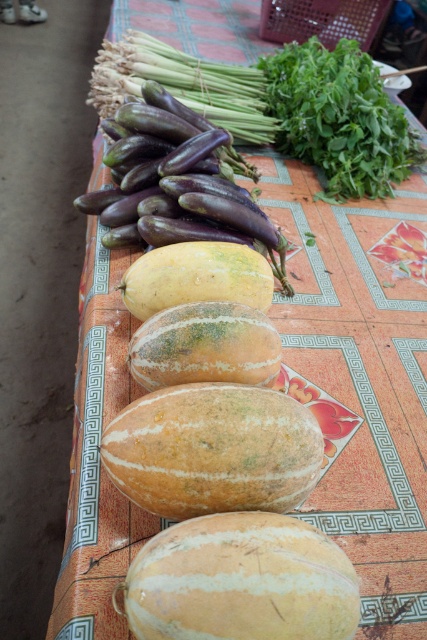
Question: Is green striped melon at center thinner than yellow-green matte squash at center?

Choices:
 (A) no
 (B) yes

Answer: (B)

Question: Based on their relative distances, which object is nearer to the greenish-yellow textured cantaloupe at center?

Choices:
 (A) yellow-green matte squash at center
 (B) green striped melon at center

Answer: (B)

Question: Which point is closer to the camera?

Choices:
 (A) (183, 372)
 (B) (125, 275)
 (C) (183, 464)
 (D) (222, 547)

Answer: (D)

Question: Which point is farther to the camera?

Choices:
 (A) greenish-yellow textured cantaloupe at center
 (B) purple matte eggplant at center
 (C) yellow-green matte squash at center

Answer: (B)

Question: Considering the relative positions of greenish-yellow textured cantaloupe at center and purple matte eggplant at center in the image provided, where is greenish-yellow textured cantaloupe at center located with respect to purple matte eggplant at center?

Choices:
 (A) left
 (B) right

Answer: (B)

Question: Does greenish-yellow textured cantaloupe at center have a smaller size compared to green striped melon at center?

Choices:
 (A) yes
 (B) no

Answer: (B)